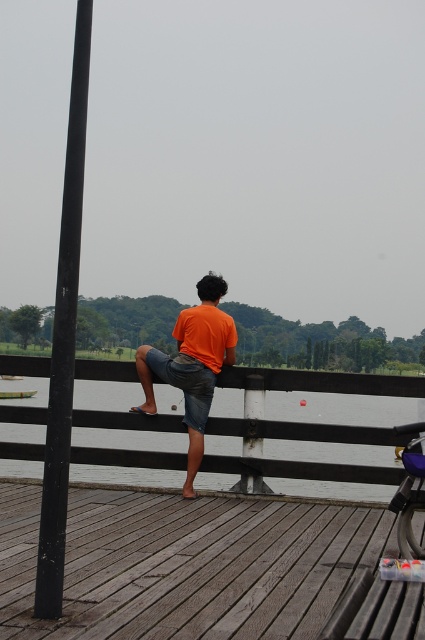
You are standing on the wooden deck and want to place a small potted plant between the two points, point (252, 380) and point (195, 436). Will the plant be closer to the person sitting on the railing or the metal post on the left?

The point (252, 380) is closer to the viewer than point (195, 436). Since the person is sitting on the railing which is part of the deck structure, placing the plant between these two points would position it closer to the person sitting on the railing.